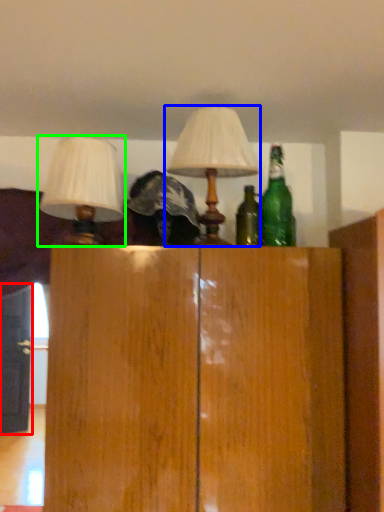
Question: Considering the real-world distances, which object is closest to door (highlighted by a red box)? lamp (highlighted by a blue box) or lamp (highlighted by a green box).

Choices:
 (A) lamp
 (B) lamp

Answer: (B)